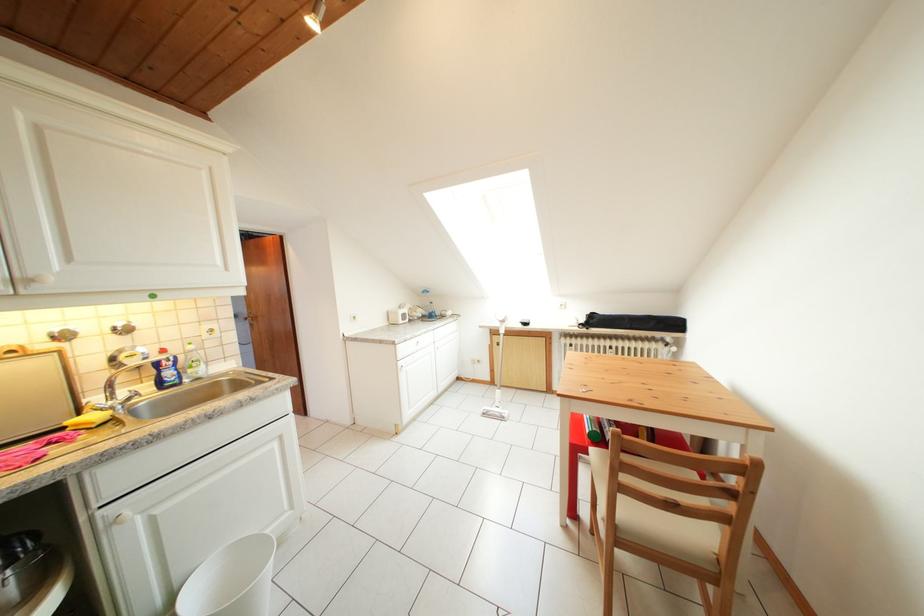
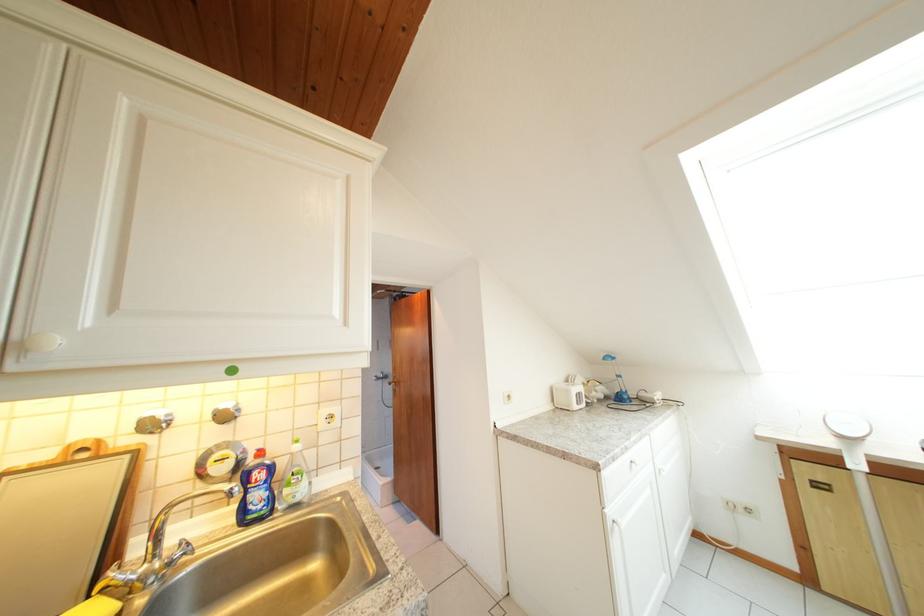
The point at (406, 318) is marked in the first image. Where is the corresponding point in the second image?

(577, 397)